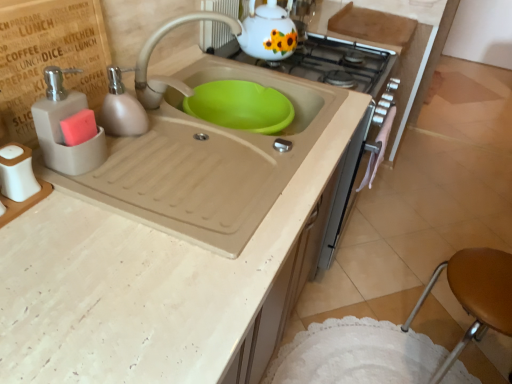
Question: Looking at the image, does white glossy gas stove at upper center seem bigger or smaller compared to matte gray soap dispenser at left, the 2th soap dispenser positioned from the back?

Choices:
 (A) big
 (B) small

Answer: (A)

Question: In the image, is white glossy gas stove at upper center positioned in front of or behind matte gray soap dispenser at left, which appears as the 1th soap dispenser when viewed from the front?

Choices:
 (A) behind
 (B) front

Answer: (A)

Question: Which of these objects is positioned farthest from the beige matte sink at center?

Choices:
 (A) white glossy gas stove at upper center
 (B) matte beige soap dispenser at left, the second soap dispenser in the front-to-back sequence
 (C) white matte salt shaker at left
 (D) brown leather stool at lower right
 (E) matte beige faucet at sink center

Answer: (D)

Question: Which object is the farthest from the matte gray soap dispenser at left?

Choices:
 (A) white matte salt shaker at left
 (B) beige matte sink at center
 (C) matte beige soap dispenser at left, which is the first soap dispenser in back-to-front order
 (D) matte gray soap dispenser at left, the 2th soap dispenser positioned from the back
 (E) white ceramic teapot at upper center

Answer: (E)